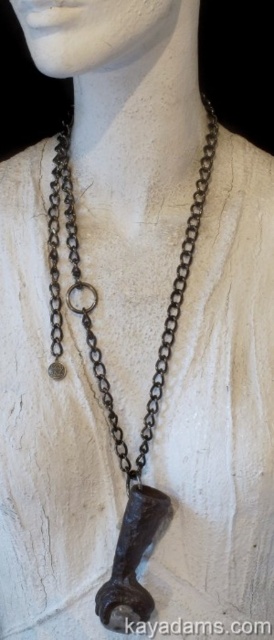
Identify the location of white matte head at center. (92, 32).

Does white matte head at center have a lesser width compared to matte black clasp at center?

Incorrect, white matte head at center's width is not less than matte black clasp at center's.

Is point (92, 22) less distant than point (118, 618)?

Yes, it is.

I want to click on white matte head at center, so click(x=92, y=32).

How far apart are rusty chain at center and matte black clasp at center?

9.73 inches

The image size is (274, 640). What do you see at coordinates (96, 292) in the screenshot?
I see `rusty chain at center` at bounding box center [96, 292].

Locate an element on the screen. rusty chain at center is located at coordinates (96, 292).

Image resolution: width=274 pixels, height=640 pixels. What do you see at coordinates (96, 292) in the screenshot? I see `rusty chain at center` at bounding box center [96, 292].

Is rusty chain at center further to the viewer compared to white matte head at center?

That is True.

Between point (166, 316) and point (29, 42), which one is positioned behind?

The point (166, 316) is behind.

Where is `rusty chain at center`? The width and height of the screenshot is (274, 640). rusty chain at center is located at coordinates (96, 292).